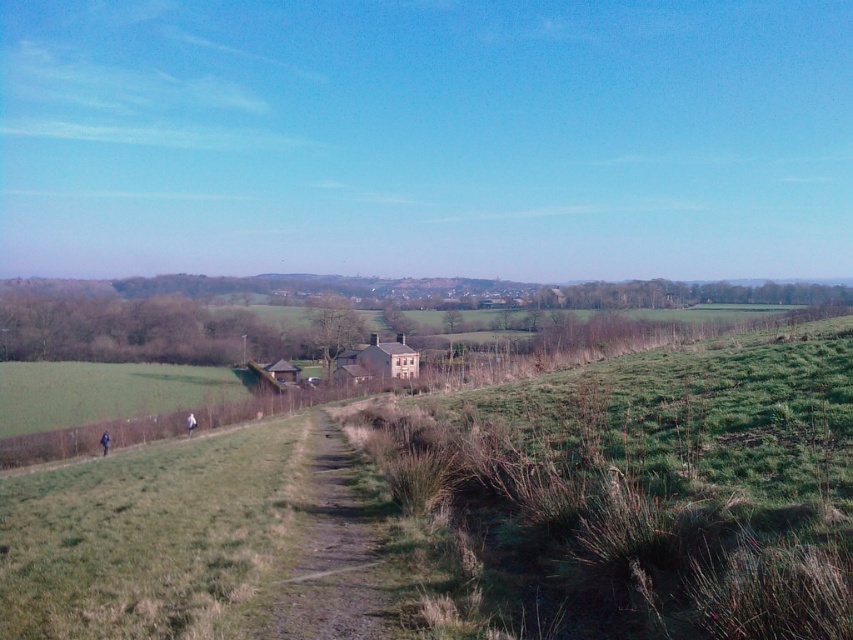
Question: Can you confirm if green grassy at center is positioned to the left of dirt/gravel path at center?

Choices:
 (A) yes
 (B) no

Answer: (B)

Question: Does green grassy at center have a greater width compared to dirt/gravel path at center?

Choices:
 (A) yes
 (B) no

Answer: (A)

Question: Can you confirm if green grassy at center is positioned to the left of dirt/gravel path at center?

Choices:
 (A) yes
 (B) no

Answer: (B)

Question: Which point appears farthest from the camera in this image?

Choices:
 (A) (469, 513)
 (B) (287, 636)

Answer: (A)

Question: Which point is closer to the camera?

Choices:
 (A) green grassy at center
 (B) dirt/gravel path at center

Answer: (A)

Question: Among these points, which one is nearest to the camera?

Choices:
 (A) (733, 582)
 (B) (352, 561)

Answer: (A)